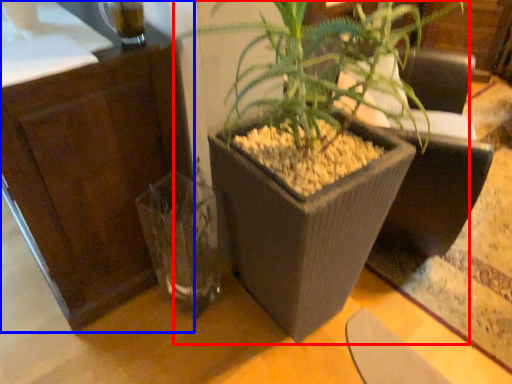
Question: Which object appears farthest to the camera in this image, houseplant (highlighted by a red box) or dresser (highlighted by a blue box)?

Choices:
 (A) houseplant
 (B) dresser

Answer: (B)